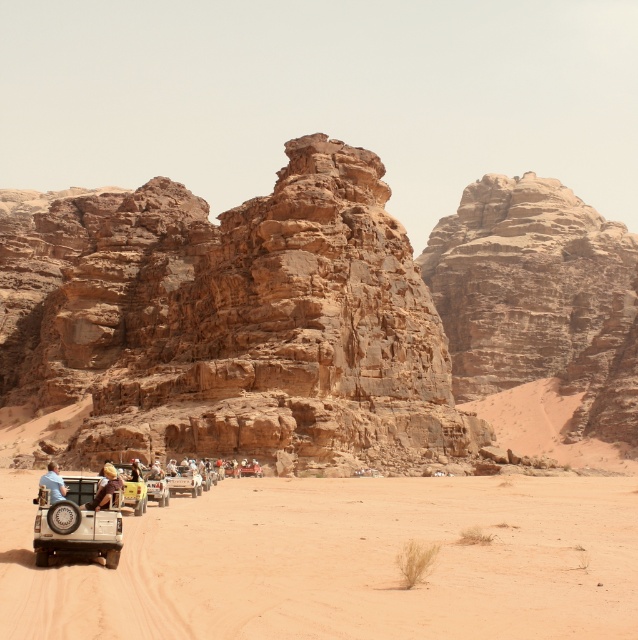
Question: Which point is closer to the camera?

Choices:
 (A) brown sandy dirt track at lower left
 (B) rustic sandstone rock formation at center
 (C) brown leather jacket at lower left
 (D) light brown leather jacket at lower left

Answer: (A)

Question: Is brown leather jacket at lower left smaller than light brown leather jacket at lower left?

Choices:
 (A) no
 (B) yes

Answer: (B)

Question: Which of the following is the closest to the observer?

Choices:
 (A) brown sandy dirt track at lower left
 (B) matte beige jeep at lower left

Answer: (A)

Question: Does brown leather jacket at lower left appear on the left side of light brown leather jacket at lower left?

Choices:
 (A) no
 (B) yes

Answer: (A)

Question: Can you confirm if brown sandy dirt track at lower left is positioned above matte beige jeep at lower left?

Choices:
 (A) yes
 (B) no

Answer: (B)

Question: Among these objects, which one is nearest to the camera?

Choices:
 (A) light brown leather jacket at lower left
 (B) brown leather jacket at lower left
 (C) matte beige jeep at lower left
 (D) brown sandy dirt track at lower left

Answer: (D)